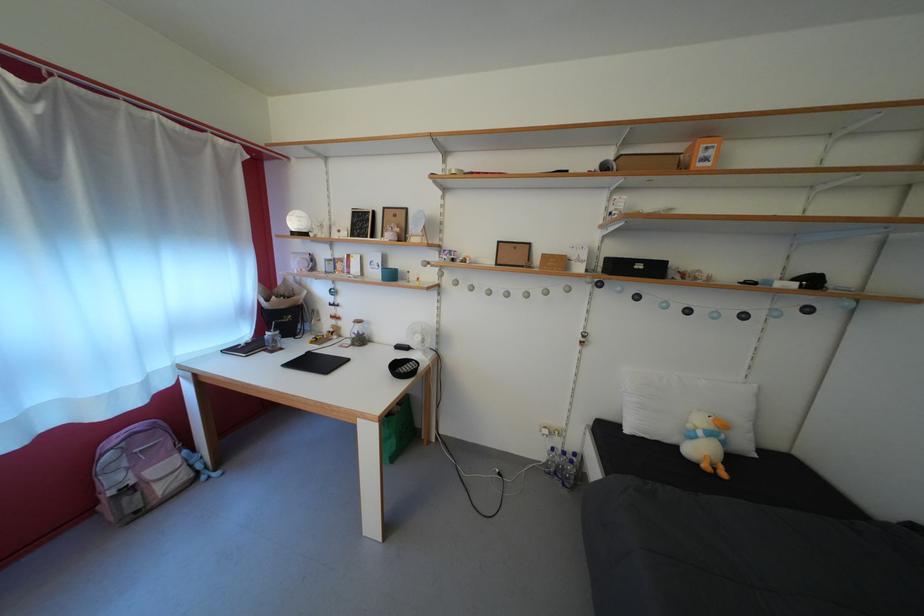
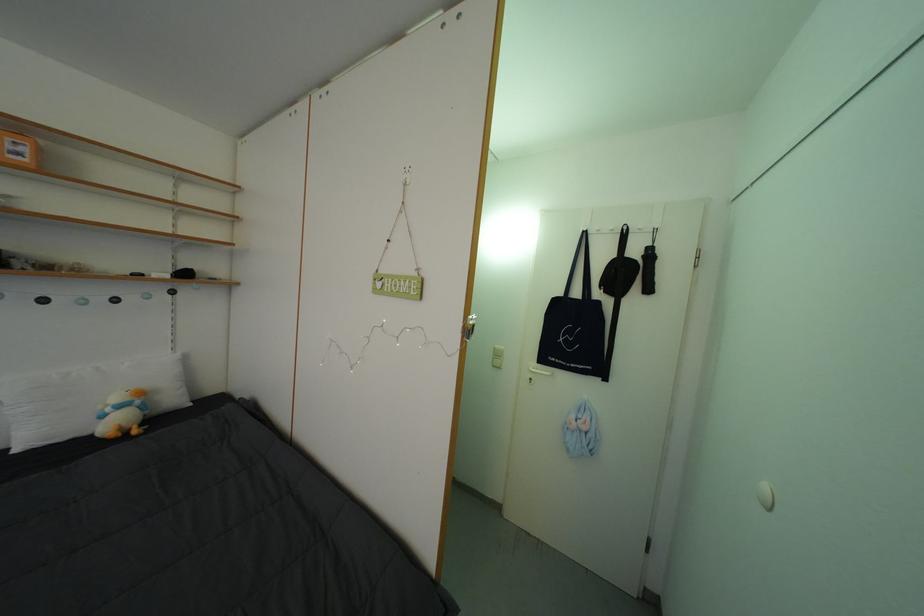
Locate, in the second image, the point that corresponds to pixel 714 166 in the first image.

(27, 160)